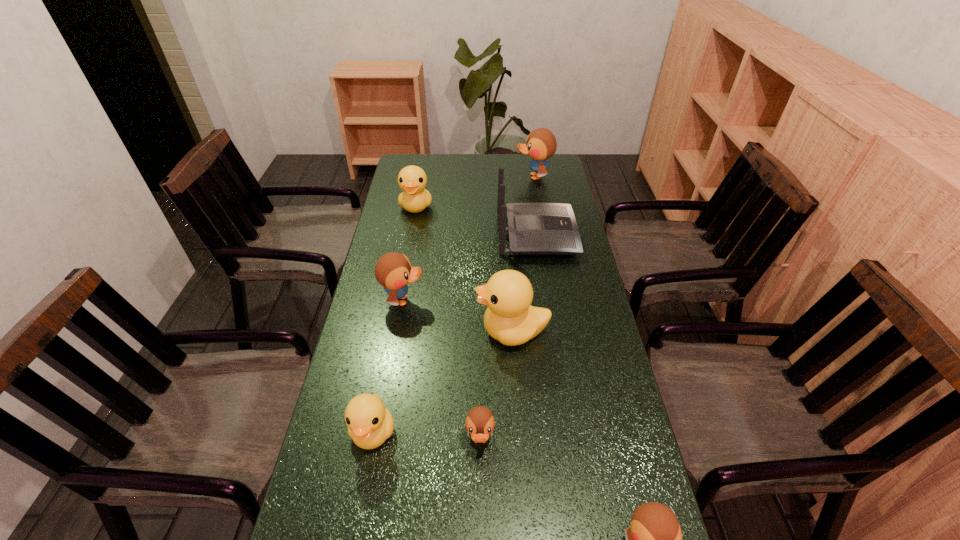
Identify the location of free space between the farthest blue duck and the second farthest blue duck. (468, 238).

You are a GUI agent. You are given a task and a screenshot of the screen. Output one action in this format:
    pyautogui.click(x=<x>, y=<y>)
    Task: Click on the blank region between the third farthest blue duck and the second farthest duck
    
    Given the screenshot: What is the action you would take?
    pyautogui.click(x=448, y=323)

Find the location of a particular element. Image resolution: width=960 pixels, height=540 pixels. vacant space in between the second blue duck from left to right and the second biggest blue duck is located at coordinates (442, 370).

The image size is (960, 540). I want to click on vacant region between the farthest object and the smallest yellow duck, so click(454, 304).

Point out which object is positioned as the second nearest to the nearest yellow duck. Please provide its 2D coordinates. Your answer should be formatted as a tuple, i.e. [(x, y)], where the tuple contains the x and y coordinates of a point satisfying the conditions above.

[(510, 318)]

Point out which object is positioned as the seventh nearest to the nearest yellow duck. Please provide its 2D coordinates. Your answer should be formatted as a tuple, i.e. [(x, y)], where the tuple contains the x and y coordinates of a point satisfying the conditions above.

[(541, 144)]

I want to click on duck identified as the fourth closest to the second smallest yellow duck, so click(x=369, y=423).

Find the location of a particular element. The width and height of the screenshot is (960, 540). duck identified as the third closest to the router is located at coordinates pyautogui.click(x=412, y=180).

Identify which blue duck is the second nearest to the sixth nearest duck. Please provide its 2D coordinates. Your answer should be formatted as a tuple, i.e. [(x, y)], where the tuple contains the x and y coordinates of a point satisfying the conditions above.

[(393, 270)]

This screenshot has width=960, height=540. In order to click on blue duck that is the fourth closest to the second farthest yellow duck in this screenshot , I will do `click(541, 144)`.